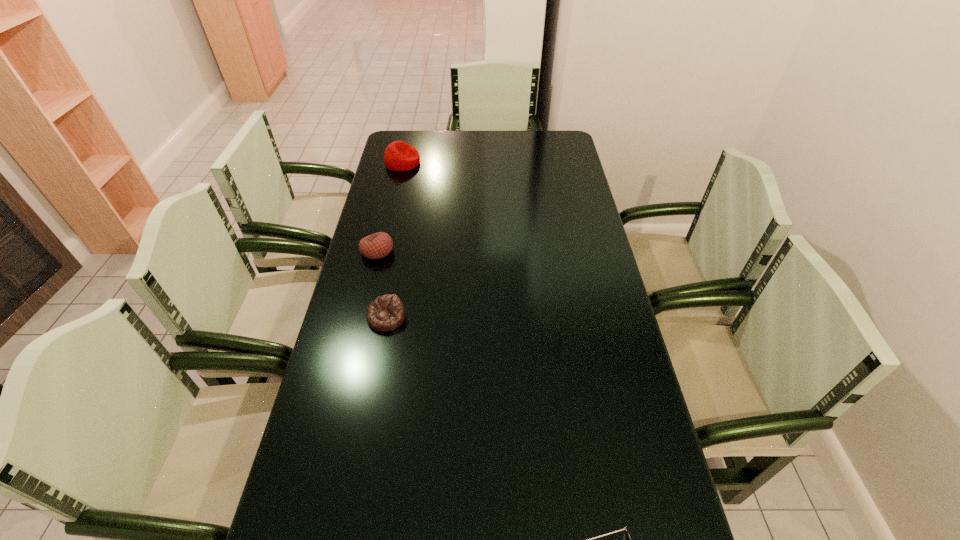
You are a GUI agent. You are given a task and a screenshot of the screen. Output one action in this format:
    pyautogui.click(x=<x>, y=<y>)
    Task: Click on the tallest object
    
    Given the screenshot: What is the action you would take?
    pyautogui.click(x=399, y=156)

At what (x,y) coordinates should I click in order to perform the action: click on the farthest beanbag. Please return your answer as a coordinate pair (x, y). Looking at the image, I should click on (399, 156).

This screenshot has height=540, width=960. In order to click on the second farthest beanbag in this screenshot , I will do `click(378, 245)`.

Find the location of `the second tallest beanbag`. the second tallest beanbag is located at coordinates (378, 245).

Identify the location of the nearest beanbag. The image size is (960, 540). [386, 313].

Locate an element on the screen. The height and width of the screenshot is (540, 960). the third farthest object is located at coordinates (386, 313).

Where is `vacant space located 0.120m on the seat area of the tallest object`? vacant space located 0.120m on the seat area of the tallest object is located at coordinates (449, 163).

The image size is (960, 540). I want to click on free spot located 0.120m on the front of the second shortest beanbag, so click(368, 291).

Where is `free space located on the left of the nearest beanbag`? This screenshot has height=540, width=960. free space located on the left of the nearest beanbag is located at coordinates (343, 318).

Find the location of a particular element. object that is at the far edge is located at coordinates (399, 156).